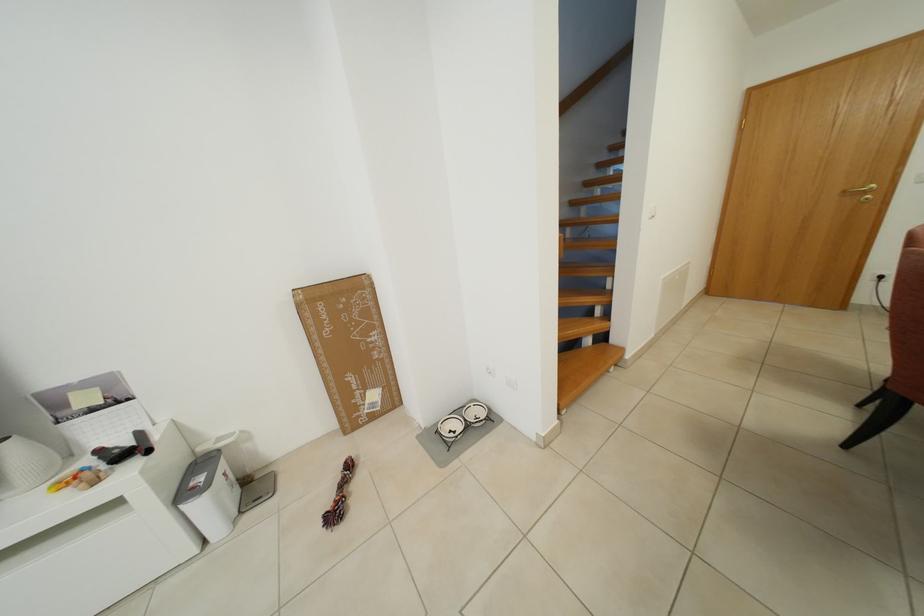
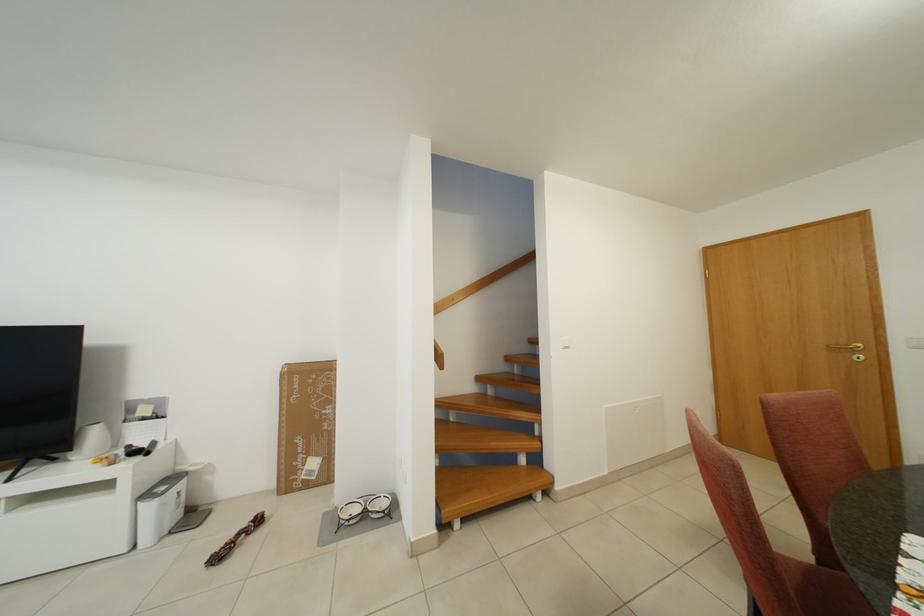
Locate, in the second image, the point that corresponds to (x=346, y=479) in the first image.

(252, 528)